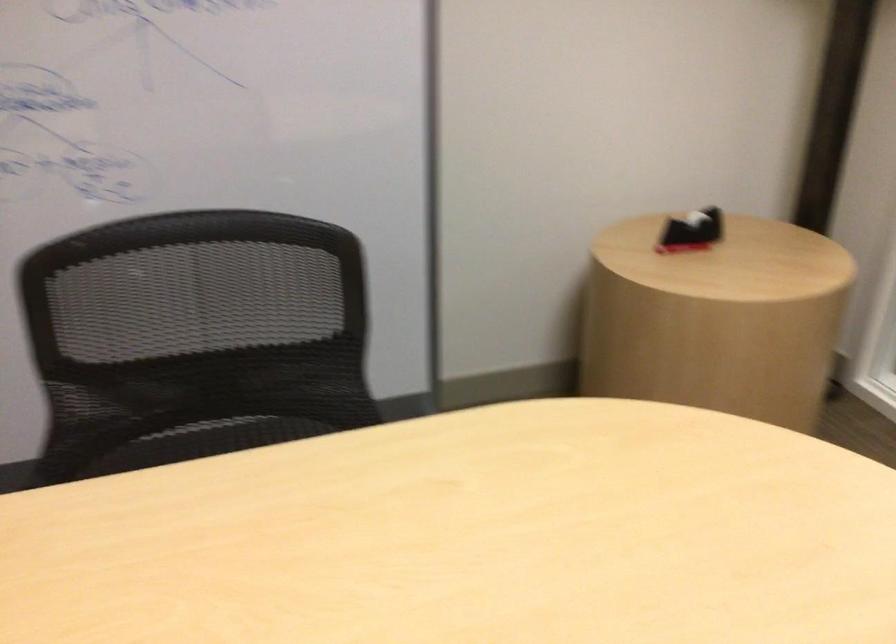
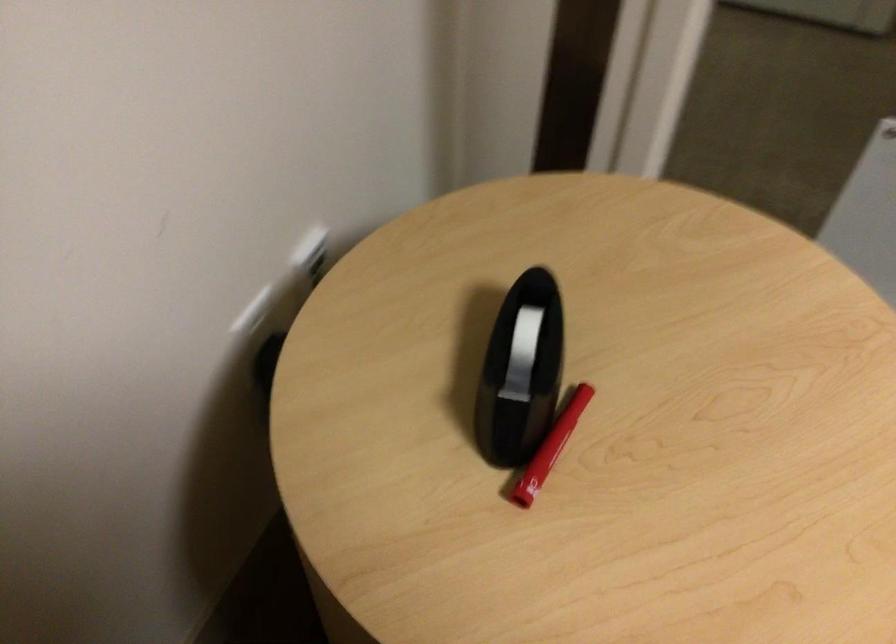
Locate, in the second image, the point that corresponds to [684,220] in the first image.

(521, 354)